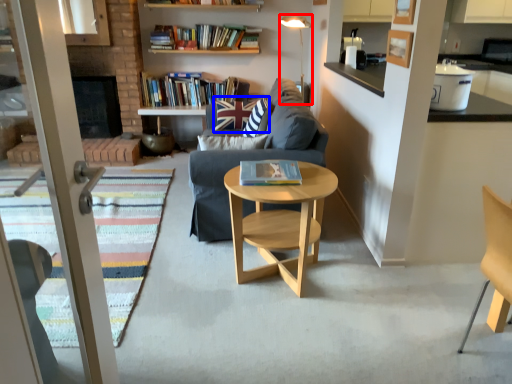
Question: Among these objects, which one is nearest to the camera, lamp (highlighted by a red box) or pillow (highlighted by a blue box)?

Choices:
 (A) lamp
 (B) pillow

Answer: (B)